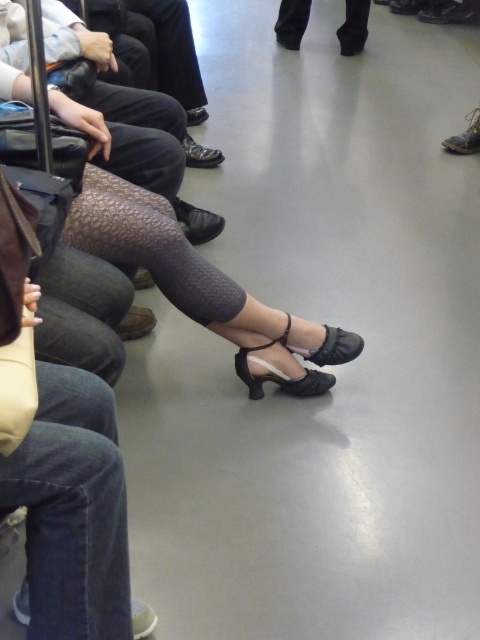
You are a passenger on the train and you want to place a small bag between the black leather sandal at lower center and the leather boot at lower right. Can you fit it there?

The black leather sandal at lower center might be wider than the leather boot at lower right, so there may not be enough space to fit the bag between them.